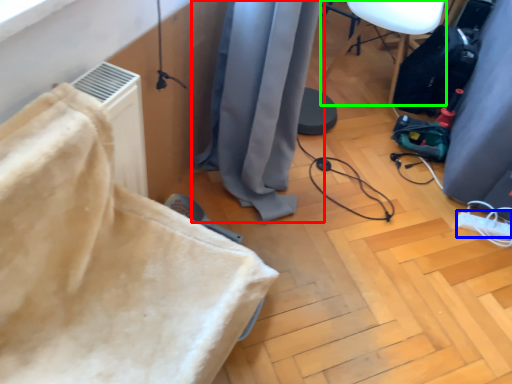
Question: Which is nearer to the curtain (highlighted by a red box)? extension cord (highlighted by a blue box) or furniture (highlighted by a green box).

Choices:
 (A) extension cord
 (B) furniture

Answer: (B)